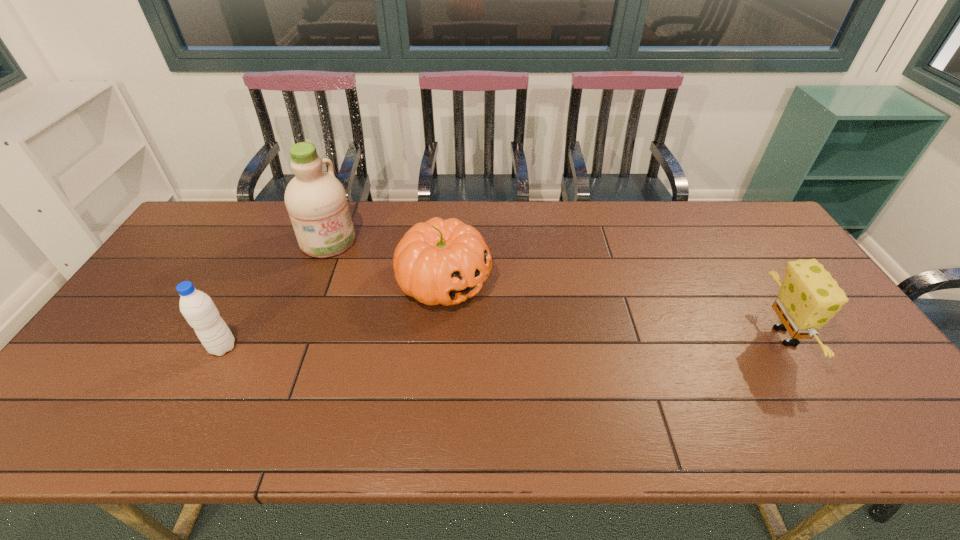
This screenshot has width=960, height=540. I want to click on free location located on the carved face of the third object from left to right, so click(x=601, y=372).

Where is `vacant space situated on the carved face of the third object from left to right`? This screenshot has width=960, height=540. vacant space situated on the carved face of the third object from left to right is located at coordinates (523, 327).

The image size is (960, 540). Identify the location of free space located 0.340m on the carved face of the third object from left to right. (590, 365).

Identify the location of object that is at the far edge. (316, 201).

Where is `object located in the near edge section of the desktop`? object located in the near edge section of the desktop is located at coordinates (808, 297).

The width and height of the screenshot is (960, 540). I want to click on object situated at the right edge, so click(x=808, y=297).

Find the location of a particular element. This screenshot has height=540, width=960. object that is at the near right corner is located at coordinates (808, 297).

Image resolution: width=960 pixels, height=540 pixels. In the image, there is a desktop. Identify the location of vacant space at the far edge. (593, 239).

In the image, there is a desktop. Where is `free region at the near edge`? The image size is (960, 540). free region at the near edge is located at coordinates (455, 376).

Identify the location of vacant area at the left edge. (120, 319).